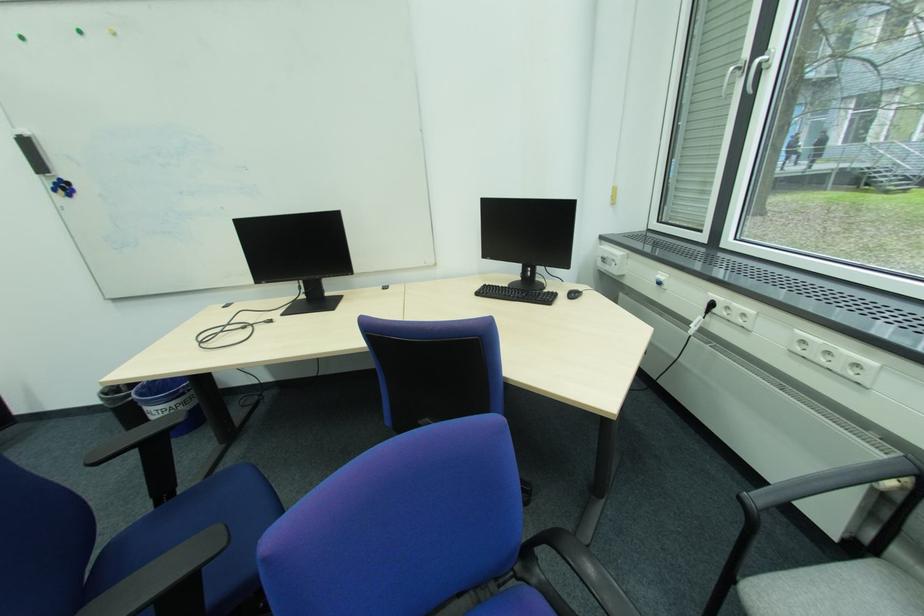
The height and width of the screenshot is (616, 924). Describe the element at coordinates (833, 591) in the screenshot. I see `the gray chair sitting surface` at that location.